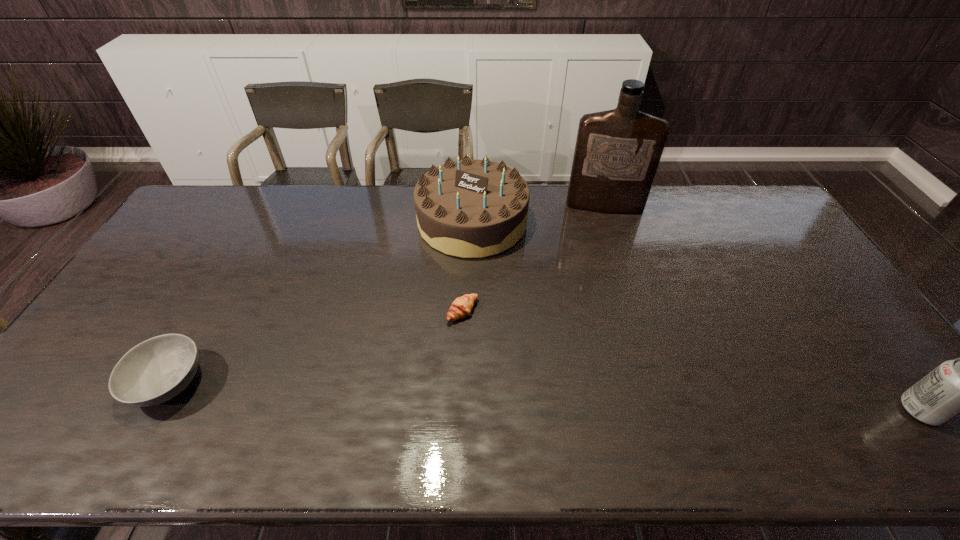
Locate an element on the screen. The height and width of the screenshot is (540, 960). free region located on the left of the soda can is located at coordinates (822, 410).

The height and width of the screenshot is (540, 960). Find the location of `free region located 0.260m on the label side of the liquor`. free region located 0.260m on the label side of the liquor is located at coordinates (604, 266).

Image resolution: width=960 pixels, height=540 pixels. What are the coordinates of `free space located on the label side of the liquor` in the screenshot? It's located at (606, 291).

Find the location of `vacant area situated 0.120m on the label side of the liquor`. vacant area situated 0.120m on the label side of the liquor is located at coordinates point(602,237).

You are a GUI agent. You are given a task and a screenshot of the screen. Output one action in this format:
    pyautogui.click(x=<x>, y=<y>)
    Task: Click on the free point located on the front-facing side of the third nearest object
    The width and height of the screenshot is (960, 540).
    Given the screenshot: What is the action you would take?
    pyautogui.click(x=552, y=373)

Find the location of `free spot located on the front-facing side of the third nearest object`. free spot located on the front-facing side of the third nearest object is located at coordinates (523, 353).

Image resolution: width=960 pixels, height=540 pixels. I want to click on free space located on the front-facing side of the third nearest object, so click(530, 357).

The height and width of the screenshot is (540, 960). I want to click on free space located on the front-facing side of the second tallest object, so click(443, 334).

Find the location of a particular element. Image resolution: width=960 pixels, height=540 pixels. vacant region located 0.320m on the front-facing side of the second tallest object is located at coordinates (441, 340).

You are a GUI agent. You are given a task and a screenshot of the screen. Output one action in this format:
    pyautogui.click(x=<x>, y=<y>)
    Task: Click on the free space located on the front-facing side of the second tallest object
    This screenshot has height=540, width=960.
    Given the screenshot: What is the action you would take?
    pyautogui.click(x=442, y=338)